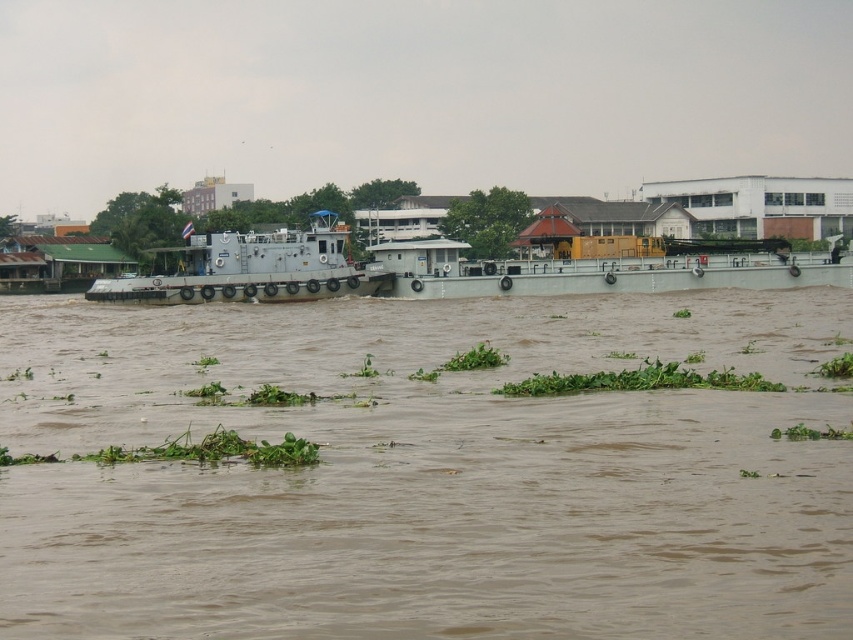
Does brown muddy water at center have a larger size compared to gray metallic barge at center?

No.

Can you confirm if brown muddy water at center is positioned to the right of gray metallic barge at center?

No, brown muddy water at center is not to the right of gray metallic barge at center.

The width and height of the screenshot is (853, 640). Describe the element at coordinates (427, 474) in the screenshot. I see `brown muddy water at center` at that location.

Where is `brown muddy water at center`? brown muddy water at center is located at coordinates point(427,474).

Between brown muddy water at center and gray metallic tugboat at center, which one appears on the right side from the viewer's perspective?

Positioned to the right is brown muddy water at center.

The width and height of the screenshot is (853, 640). Describe the element at coordinates (427, 474) in the screenshot. I see `brown muddy water at center` at that location.

Does point (624, 438) come in front of point (296, 300)?

Yes, point (624, 438) is in front of point (296, 300).

Identify the location of brown muddy water at center. (427, 474).

Between point (593, 284) and point (136, 298), which one is positioned behind?

The point (593, 284) is more distant.

Can you confirm if gray metallic barge at center is bigger than gray metallic tugboat at center?

Indeed, gray metallic barge at center has a larger size compared to gray metallic tugboat at center.

Between point (503, 260) and point (374, 275), which one is positioned behind?

Point (503, 260)

Find the location of a particular element. gray metallic barge at center is located at coordinates (x=601, y=268).